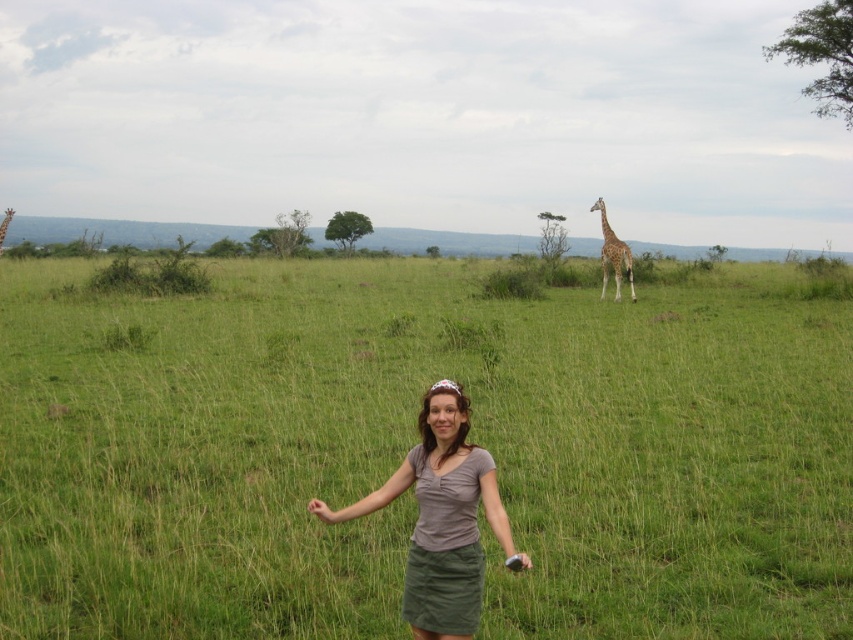
Can you confirm if green grassy field at center is positioned above spotted fur giraffe at right?

Actually, green grassy field at center is below spotted fur giraffe at right.

Who is positioned more to the left, green grassy field at center or spotted fur giraffe at right?

Positioned to the left is green grassy field at center.

Describe the element at coordinates (415, 444) in the screenshot. This screenshot has width=853, height=640. I see `green grassy field at center` at that location.

Image resolution: width=853 pixels, height=640 pixels. What are the coordinates of `green grassy field at center` in the screenshot? It's located at (415, 444).

Can you confirm if spotted fur giraffe at right is bigger than brown textured giraffe at upper right?

Actually, spotted fur giraffe at right might be smaller than brown textured giraffe at upper right.

Locate an element on the screen. spotted fur giraffe at right is located at coordinates (613, 256).

The height and width of the screenshot is (640, 853). In order to click on spotted fur giraffe at right in this screenshot , I will do `click(613, 256)`.

Which is behind, point (424, 531) or point (606, 275)?

Point (606, 275)

Is matte gray shirt at center smaller than spotted fur giraffe at right?

Incorrect, matte gray shirt at center is not smaller in size than spotted fur giraffe at right.

You are a GUI agent. You are given a task and a screenshot of the screen. Output one action in this format:
    pyautogui.click(x=<x>, y=<y>)
    Task: Click on the matte gray shirt at center
    This screenshot has height=640, width=853.
    Given the screenshot: What is the action you would take?
    pyautogui.click(x=440, y=518)